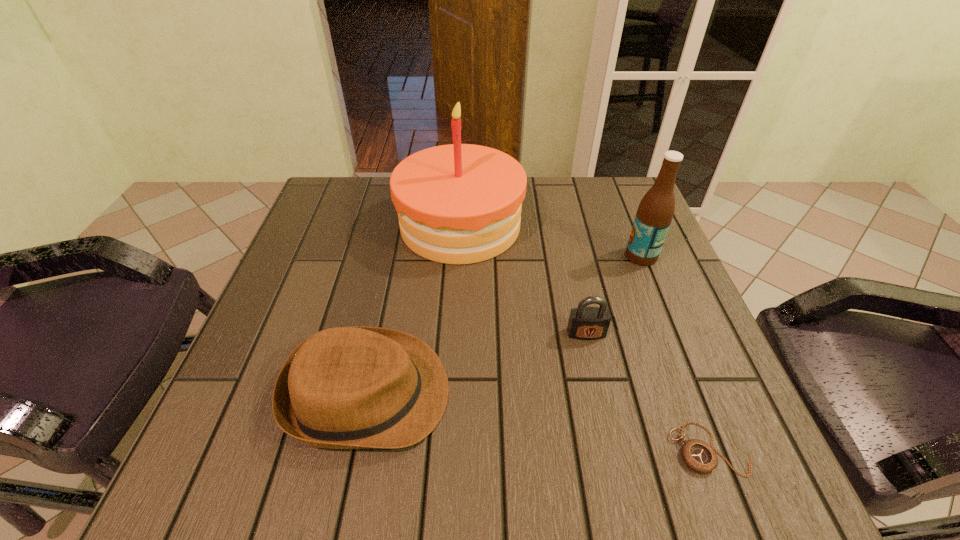
Locate an element on the screen. The width and height of the screenshot is (960, 540). vacant space at the left edge of the desktop is located at coordinates (305, 264).

The width and height of the screenshot is (960, 540). What are the coordinates of `vacant space at the right edge of the desktop` in the screenshot? It's located at (745, 414).

Where is `vacant space at the far left corner`? vacant space at the far left corner is located at coordinates coord(346,194).

This screenshot has width=960, height=540. In order to click on free spot at the far right corner of the desktop in this screenshot , I will do `click(642, 197)`.

In order to click on vacant region at the near right corner of the desktop in this screenshot , I will do point(656,437).

Find the location of `free space between the fourth shortest object and the fedora`. free space between the fourth shortest object and the fedora is located at coordinates (504, 325).

You are a GUI agent. You are given a task and a screenshot of the screen. Output one action in this format:
    pyautogui.click(x=<x>, y=<y>)
    Task: Click on the unoccupied area between the fourth shortest object and the pocket watch
    
    Given the screenshot: What is the action you would take?
    pyautogui.click(x=676, y=352)

The image size is (960, 540). I want to click on free space between the third object from left to right and the pocket watch, so click(x=648, y=391).

This screenshot has width=960, height=540. I want to click on vacant area that lies between the shortest object and the fourth shortest object, so click(676, 352).

Locate an element on the screen. This screenshot has height=540, width=960. free space between the tallest object and the third object from left to right is located at coordinates (523, 279).